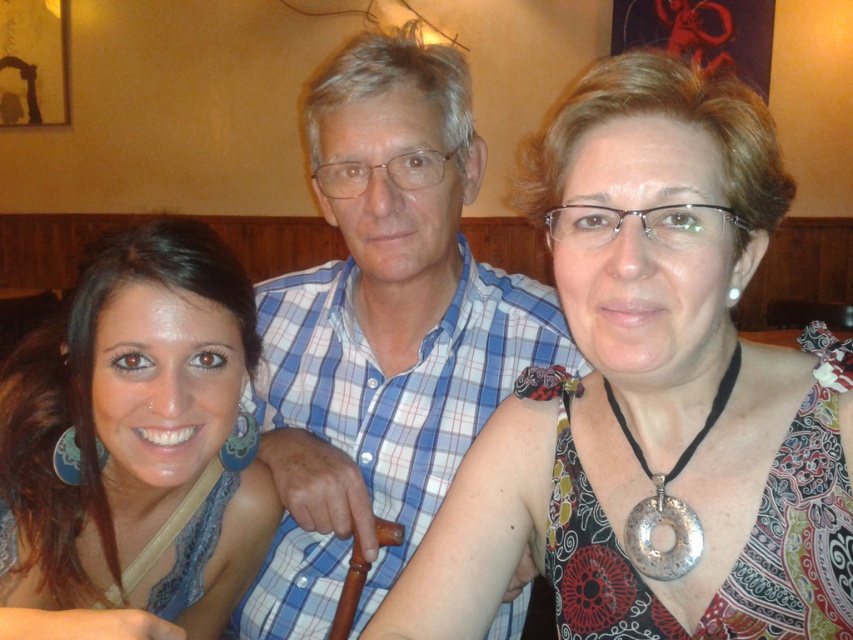
Does blue checkered shirt at center appear on the left side of matte blue dress at center?

No, blue checkered shirt at center is not to the left of matte blue dress at center.

You are a GUI agent. You are given a task and a screenshot of the screen. Output one action in this format:
    pyautogui.click(x=<x>, y=<y>)
    Task: Click on the blue checkered shirt at center
    
    Given the screenshot: What is the action you would take?
    pyautogui.click(x=381, y=332)

Identify the location of blue checkered shirt at center. This screenshot has width=853, height=640. (381, 332).

The image size is (853, 640). What do you see at coordinates (654, 394) in the screenshot? I see `patterned fabric dress at center` at bounding box center [654, 394].

Does point (560, 163) come in front of point (373, 413)?

Yes, it is.

The image size is (853, 640). I want to click on patterned fabric dress at center, so click(654, 394).

From the picture: Which is more to the right, patterned fabric dress at center or matte blue dress at center?

From the viewer's perspective, patterned fabric dress at center appears more on the right side.

Between point (491, 515) and point (16, 497), which one is positioned behind?

The point (16, 497) is more distant.

Find the location of a particular element. patterned fabric dress at center is located at coordinates (654, 394).